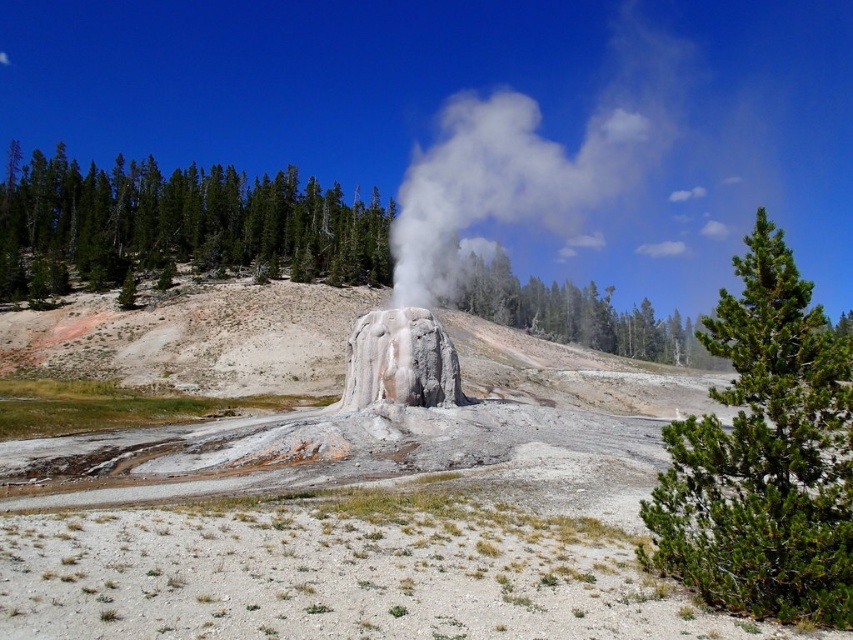
You are a geologist studying the geothermal area. You need to locate the green textured rock at center for a sample. According to the coordinates provided, where exactly should you look for it?

The green textured rock at center is located at point (177, 225).